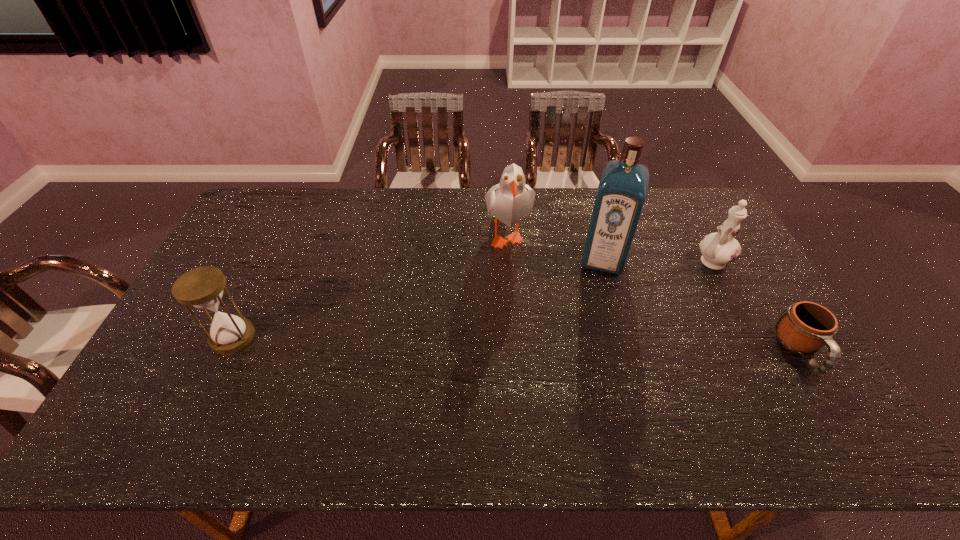
Find the location of a particular element. This screenshot has height=540, width=960. vacant space situated at the spout of the chinaware is located at coordinates (635, 312).

You are a GUI agent. You are given a task and a screenshot of the screen. Output one action in this format:
    pyautogui.click(x=<x>, y=<y>)
    Task: Click on the free space located at the spout of the chinaware
    This screenshot has height=540, width=960.
    Given the screenshot: What is the action you would take?
    pyautogui.click(x=686, y=277)

You are a GUI agent. You are given a task and a screenshot of the screen. Output one action in this format:
    pyautogui.click(x=<x>, y=<y>)
    Task: Click on the vacant point located 0.330m on the flat label side of the third object from right to left
    
    Given the screenshot: What is the action you would take?
    pyautogui.click(x=581, y=361)

Where is `vacant space situated 0.170m on the flat label side of the third object from right to left`? vacant space situated 0.170m on the flat label side of the third object from right to left is located at coordinates (591, 316).

Locate an element on the screen. vacant space situated on the flat label side of the third object from right to left is located at coordinates (586, 340).

Where is `free location located at the beak of the second tallest object`? The height and width of the screenshot is (540, 960). free location located at the beak of the second tallest object is located at coordinates (484, 293).

In order to click on blank space located at the beak of the second tallest object in this screenshot , I will do `click(471, 312)`.

The height and width of the screenshot is (540, 960). I want to click on blank space located at the beak of the second tallest object, so click(448, 348).

Locate an element on the screen. object that is at the far edge is located at coordinates (510, 201).

This screenshot has width=960, height=540. I want to click on object that is at the near edge, so click(x=804, y=327).